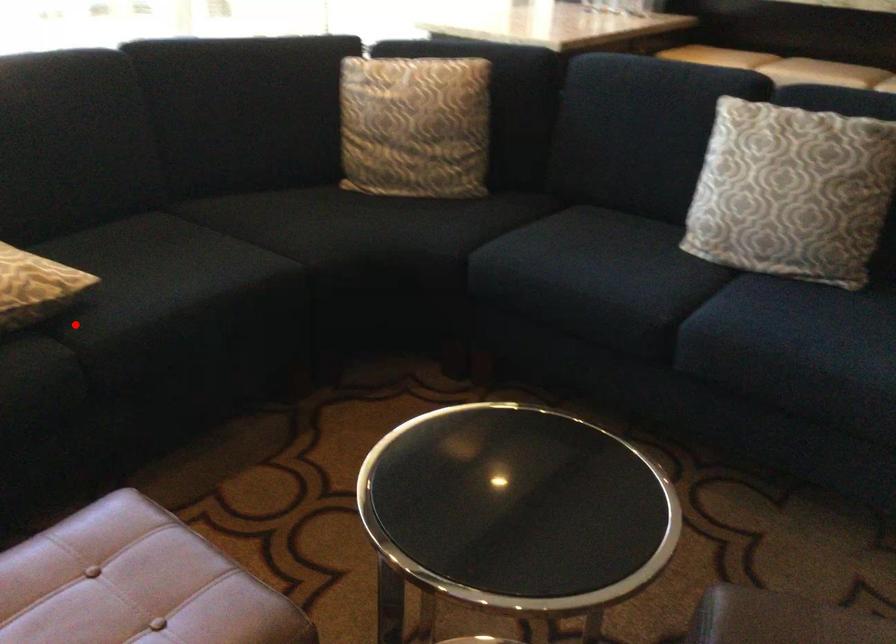
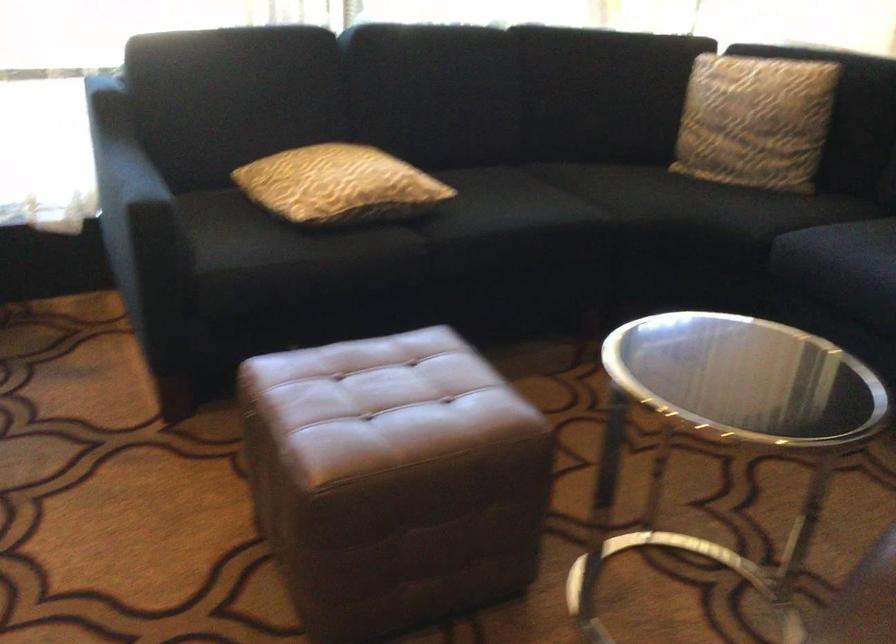
Question: I am providing you with two images of the same scene from different viewpoints. A red point is marked on the first image. Is the red point's position out of view in image 2?

Choices:
 (A) Yes
 (B) No

Answer: (B)